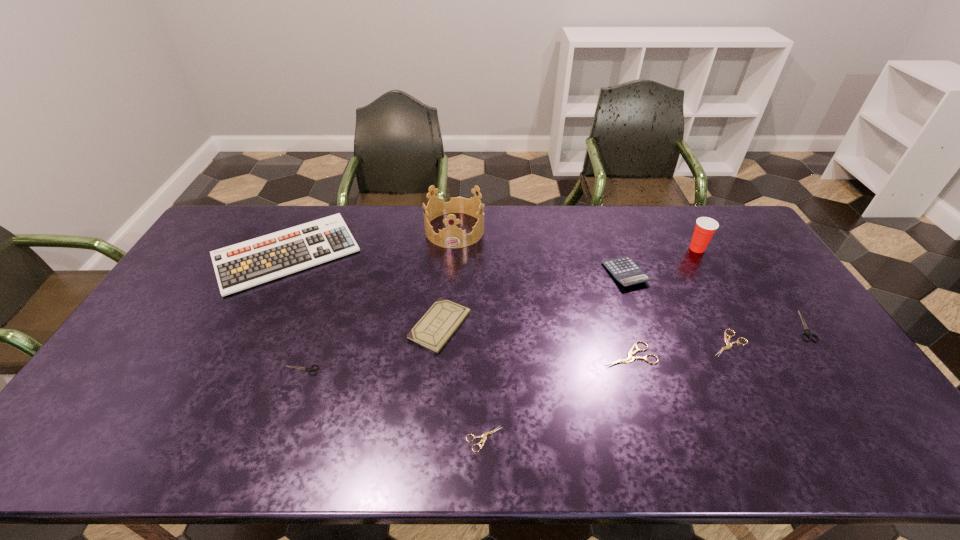
Where is `vacant space that is in between the shortest shears and the tiara`? vacant space that is in between the shortest shears and the tiara is located at coordinates (469, 334).

I want to click on the seventh closest object to the sixth shortest object, so click(729, 345).

Where is `object that is the fifth closest to the fourth shears from left to right`? object that is the fifth closest to the fourth shears from left to right is located at coordinates (484, 435).

Select which shears is the fourth closest to the right black shears. Please provide its 2D coordinates. Your answer should be formatted as a tuple, i.e. [(x, y)], where the tuple contains the x and y coordinates of a point satisfying the conditions above.

[(309, 369)]

Locate which shears is the fourth closest to the tallest object. Please provide its 2D coordinates. Your answer should be formatted as a tuple, i.e. [(x, y)], where the tuple contains the x and y coordinates of a point satisfying the conditions above.

[(729, 345)]

Identify which beige shears is the second nearest to the tallest object. Please provide its 2D coordinates. Your answer should be formatted as a tuple, i.e. [(x, y)], where the tuple contains the x and y coordinates of a point satisfying the conditions above.

[(484, 435)]

Locate an element on the screen. beige shears identified as the closest to the calculator is located at coordinates [x=729, y=345].

Locate an element on the screen. vacant position in the image that satisfies the following two spatial constraints: 1. on the back side of the nearest object; 2. on the left side of the farther black shears is located at coordinates pyautogui.click(x=484, y=326).

I want to click on free location that satisfies the following two spatial constraints: 1. on the back side of the nearest object; 2. on the left side of the ninth shortest object, so click(x=483, y=248).

Where is `vacant position in the image that satisfies the following two spatial constraints: 1. on the front side of the rightmost shears; 2. on the left side of the Dixie cup`? vacant position in the image that satisfies the following two spatial constraints: 1. on the front side of the rightmost shears; 2. on the left side of the Dixie cup is located at coordinates tap(741, 326).